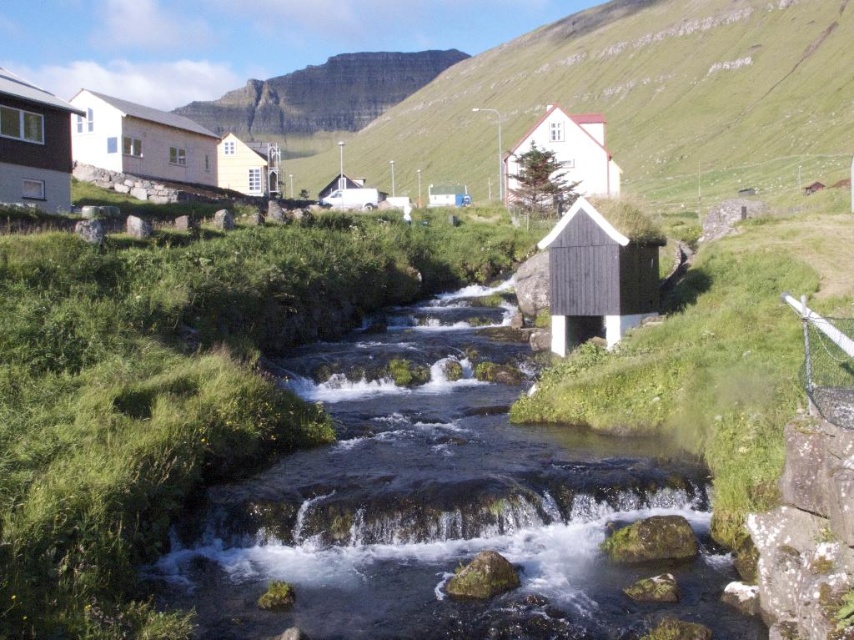
Question: Which of the following is the farthest from the observer?

Choices:
 (A) (572, 241)
 (B) (272, 168)
 (C) (306, 532)

Answer: (B)

Question: Can you confirm if clear water at center is positioned to the left of white matte hut at center?

Choices:
 (A) yes
 (B) no

Answer: (A)

Question: Is black wood hut at center smaller than matte brown hut at left?

Choices:
 (A) no
 (B) yes

Answer: (B)

Question: Which point is closer to the camera?

Choices:
 (A) white wood cabin at left
 (B) green grassy hillside at upper center
 (C) white matte hut at center
 (D) matte brown hut at left

Answer: (D)

Question: Considering the relative positions of green grassy hillside at upper center and matte brown hut at left in the image provided, where is green grassy hillside at upper center located with respect to matte brown hut at left?

Choices:
 (A) left
 (B) right

Answer: (B)

Question: Based on their relative distances, which object is farther from the white wood cabin at left?

Choices:
 (A) clear water at center
 (B) white matte hut at center

Answer: (B)